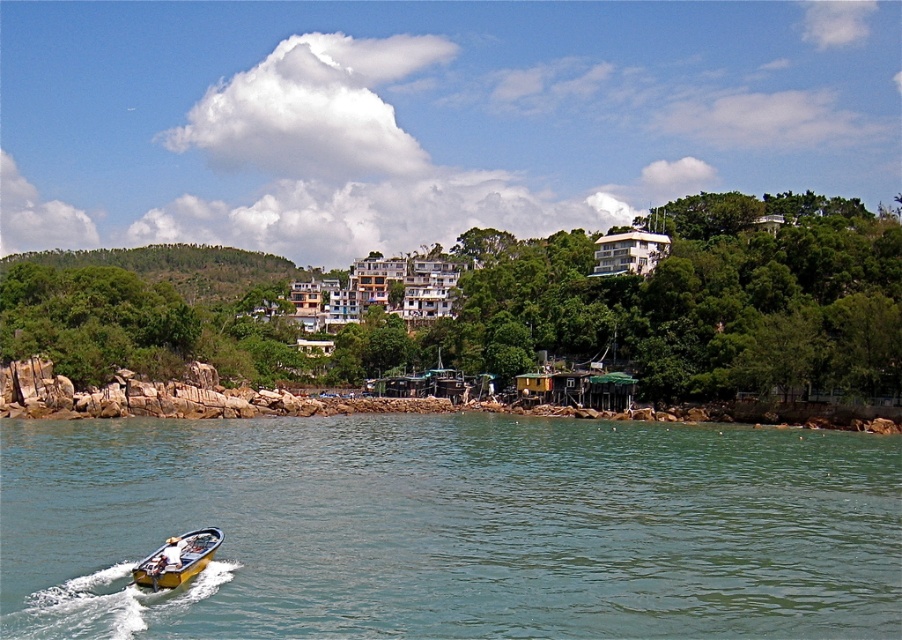
Can you confirm if clear blue water at lower left is positioned to the right of green leafy tree at lower left?

Yes, clear blue water at lower left is to the right of green leafy tree at lower left.

Is point (344, 625) positioned in front of point (646, 330)?

Yes, point (344, 625) is closer to viewer.

Locate an element on the screen. clear blue water at lower left is located at coordinates (451, 529).

Does clear blue water at lower left have a smaller size compared to yellow fiberglass boat at lower left?

No.

Does clear blue water at lower left appear on the left side of yellow fiberglass boat at lower left?

In fact, clear blue water at lower left is to the right of yellow fiberglass boat at lower left.

Identify the location of clear blue water at lower left. (451, 529).

Looking at this image, between green leafy tree at lower left and yellow fiberglass boat at lower left, which one appears on the left side from the viewer's perspective?

green leafy tree at lower left

Does green leafy tree at lower left come in front of yellow fiberglass boat at lower left?

No, it is behind yellow fiberglass boat at lower left.

Which is in front, point (888, 387) or point (162, 556)?

Point (162, 556) is more forward.

Identify the location of green leafy tree at lower left. (519, 307).